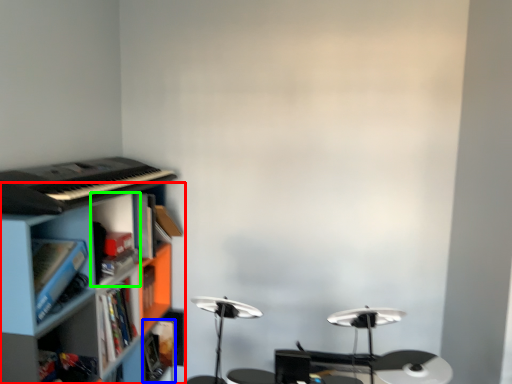
Question: Estimate the real-world distances between objects in this image. Which object is closer to shelf (highlighted by a red box), book (highlighted by a blue box) or cabinet (highlighted by a green box)?

Choices:
 (A) book
 (B) cabinet

Answer: (B)